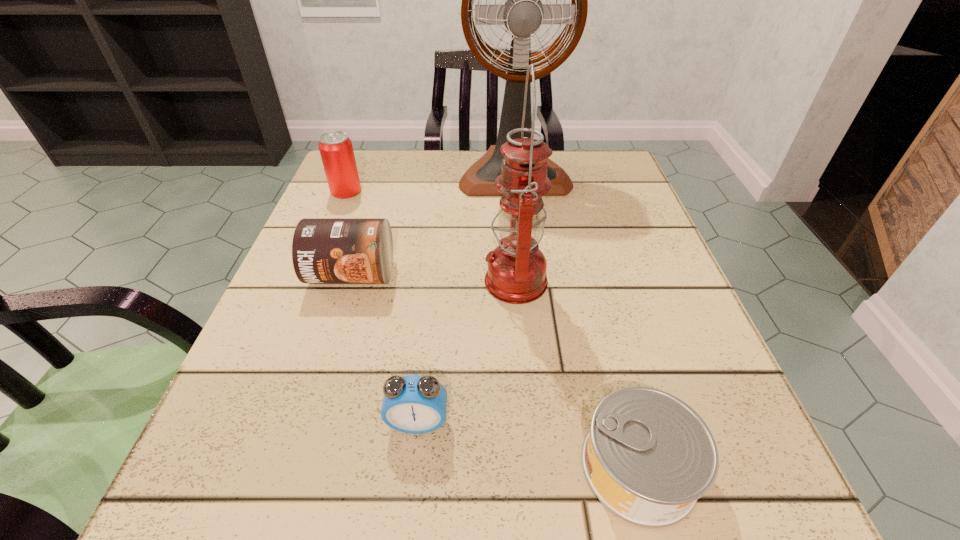
Find the location of a particular element. object present at the far left corner is located at coordinates (336, 150).

Find the location of a particular element. object that is at the far right corner is located at coordinates (523, 13).

Identify the location of object at the near right corner. (648, 457).

This screenshot has width=960, height=540. I want to click on vacant region at the far edge, so click(430, 172).

Where is `vacant space at the near edge of the desktop`? This screenshot has width=960, height=540. vacant space at the near edge of the desktop is located at coordinates (485, 538).

Find the location of `free space at the left edge of the desktop`. free space at the left edge of the desktop is located at coordinates (329, 442).

You are a GUI agent. You are given a task and a screenshot of the screen. Output one action in this format:
    pyautogui.click(x=<x>, y=<y>)
    Task: Click on the vacant space at the right edge of the desktop
    The image size is (960, 540).
    Given the screenshot: What is the action you would take?
    pyautogui.click(x=644, y=235)

In the image, there is a desktop. At what (x,y) coordinates should I click in order to perform the action: click on free space at the far left corner. Please return your answer as a coordinate pair (x, y). The width and height of the screenshot is (960, 540). Looking at the image, I should click on click(x=383, y=181).

Find the location of a particular element. The image size is (960, 540). vacant space at the near left corner of the desktop is located at coordinates (182, 509).

Where is `free spot between the fourth tallest object and the nearest can`? The height and width of the screenshot is (540, 960). free spot between the fourth tallest object and the nearest can is located at coordinates click(x=495, y=370).